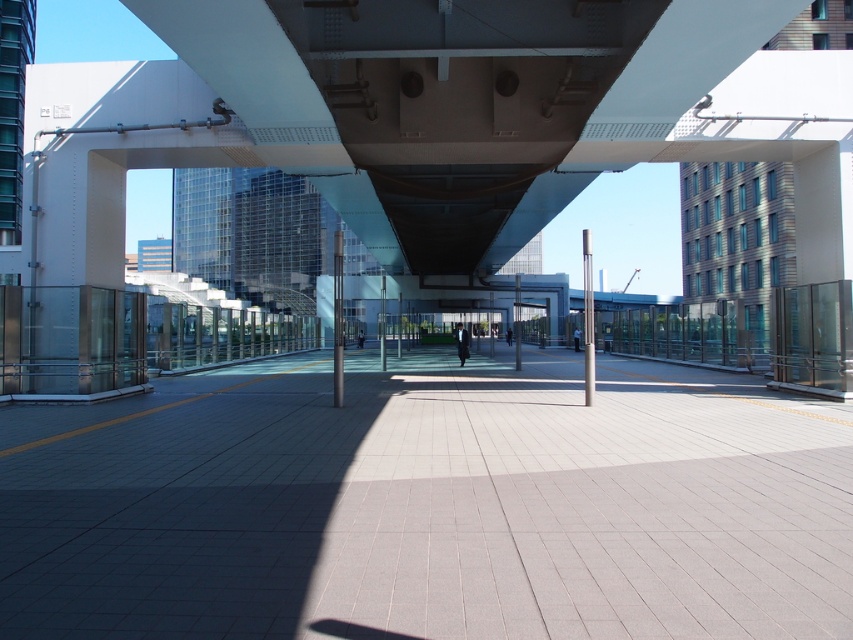
You are a delivery person carrying a heavy box and need to cross the light gray concrete pavement at center. Is the white glossy pedestrian bridge at center above or below your current position?

The light gray concrete pavement at center is positioned under the white glossy pedestrian bridge at center, so the bridge is above your current position.